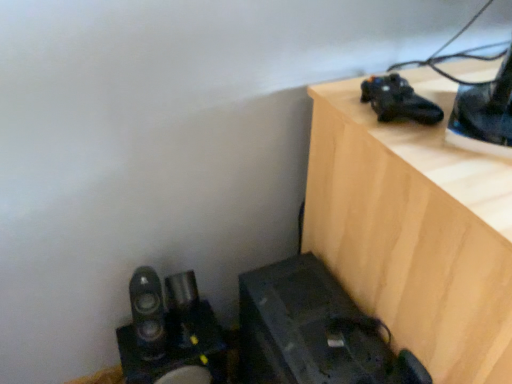
The width and height of the screenshot is (512, 384). I want to click on unoccupied area in front of black matte shoe at upper right, so click(x=439, y=155).